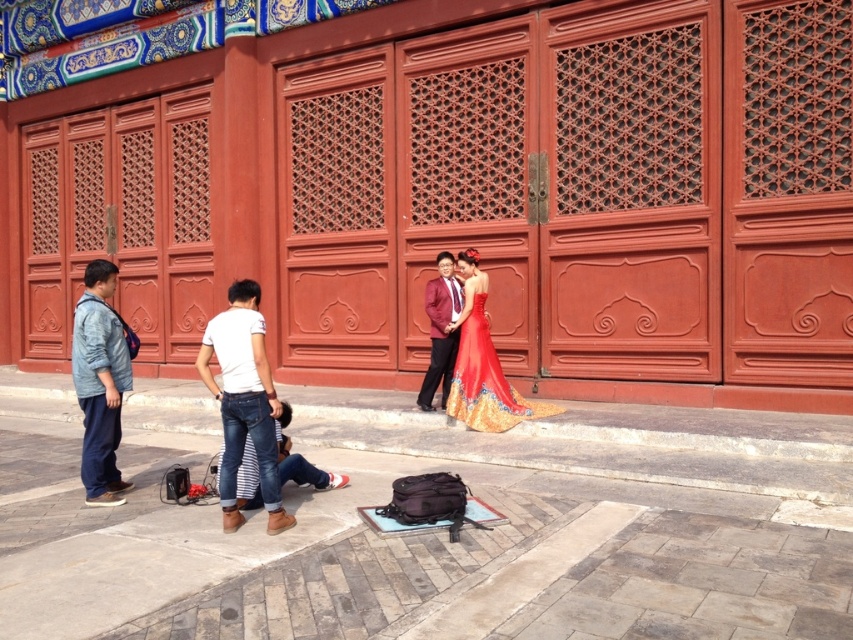
Question: From the image, what is the correct spatial relationship of denim pants at left in relation to satin burgundy suit at center?

Choices:
 (A) left
 (B) right

Answer: (A)

Question: Which point is closer to the camera?

Choices:
 (A) shiny satin gown at center
 (B) satin burgundy suit at center

Answer: (A)

Question: Which object is positioned farthest from the denim pants at left?

Choices:
 (A) white denim jeans at center
 (B) satin burgundy suit at center

Answer: (B)

Question: Is denim pants at left bigger than shiny satin gown at center?

Choices:
 (A) no
 (B) yes

Answer: (A)

Question: Estimate the real-world distances between objects in this image. Which object is farther from the denim pants at left?

Choices:
 (A) white denim jeans at center
 (B) satin burgundy suit at center
 (C) shiny satin gown at center

Answer: (C)

Question: Can you confirm if white denim jeans at center is bigger than satin burgundy suit at center?

Choices:
 (A) no
 (B) yes

Answer: (B)